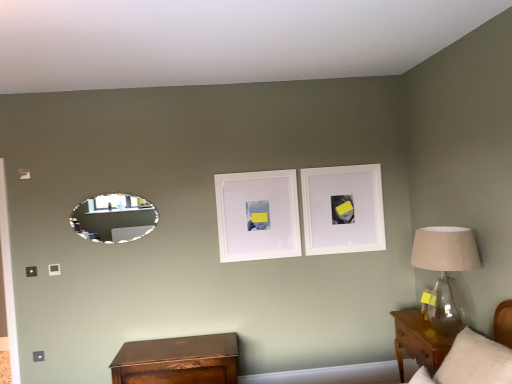
Image resolution: width=512 pixels, height=384 pixels. What do you see at coordinates (419, 341) in the screenshot?
I see `brown wood nightstand at lower right, which ranks as the second nightstand in left-to-right order` at bounding box center [419, 341].

This screenshot has height=384, width=512. What are the coordinates of `white matte picture frame at center, which is the 1th picture frame from left to right` in the screenshot? It's located at (257, 215).

Describe the element at coordinates (257, 215) in the screenshot. This screenshot has width=512, height=384. I see `white matte picture frame at center, the 2th picture frame when ordered from right to left` at that location.

You are a GUI agent. You are given a task and a screenshot of the screen. Output one action in this format:
    pyautogui.click(x=<x>, y=<y>)
    Task: Click on the clear glass lampshade at right
    
    Given the screenshot: What is the action you would take?
    pyautogui.click(x=445, y=269)

Describe the element at coordinates (445, 269) in the screenshot. I see `clear glass lampshade at right` at that location.

The image size is (512, 384). What do you see at coordinates (343, 209) in the screenshot?
I see `white matte picture frame at upper center, which is the 1th picture frame from right to left` at bounding box center [343, 209].

What is the approximate width of wooden nightstand at lower left, which is the 2th nightstand from right to left?

It is 18.38 inches.

Identify the location of brown wood nightstand at lower right, which ranks as the second nightstand in left-to-right order. This screenshot has width=512, height=384. (419, 341).

From a real-world perspective, which is physically above, brown wood nightstand at lower right, which ranks as the second nightstand in left-to-right order, or oval silver mirror at left?

From a 3D spatial view, oval silver mirror at left is above.

Could you measure the distance between brown wood nightstand at lower right, which is the 1th nightstand in right-to-left order, and oval silver mirror at left?

brown wood nightstand at lower right, which is the 1th nightstand in right-to-left order, is 2.25 meters from oval silver mirror at left.

Between point (409, 316) and point (84, 220), which one is positioned in front?

Positioned in front is point (409, 316).

Considering the positions of objects brown wood nightstand at lower right, which ranks as the second nightstand in left-to-right order, and oval silver mirror at left in the image provided, who is more to the right, brown wood nightstand at lower right, which ranks as the second nightstand in left-to-right order, or oval silver mirror at left?

From the viewer's perspective, brown wood nightstand at lower right, which ranks as the second nightstand in left-to-right order, appears more on the right side.

Is wooden nightstand at lower left, which is the 2th nightstand from right to left, outside of oval silver mirror at left?

Yes, wooden nightstand at lower left, which is the 2th nightstand from right to left, is outside of oval silver mirror at left.

Based on the photo, from the image's perspective, which object appears higher, wooden nightstand at lower left, which is the 2th nightstand from right to left, or oval silver mirror at left?

oval silver mirror at left is shown above in the image.

Considering the positions of points (228, 335) and (84, 229), is point (228, 335) closer to camera compared to point (84, 229)?

No, (228, 335) is further to viewer.

Considering the sizes of objects wooden nightstand at lower left, the first nightstand from the left, and oval silver mirror at left in the image provided, who is shorter, wooden nightstand at lower left, the first nightstand from the left, or oval silver mirror at left?

With less height is oval silver mirror at left.

From a real-world perspective, which object stands above the other?

white matte picture frame at upper center, which is the 1th picture frame from right to left, is physically above.

Is white matte picture frame at upper center, the 2th picture frame viewed from the left, a part of white matte picture frame at center, which is the 1th picture frame from left to right?

No, white matte picture frame at upper center, the 2th picture frame viewed from the left, is not a part of white matte picture frame at center, which is the 1th picture frame from left to right.

Where is `picture frame in front of the white matte picture frame at upper center, which is the 1th picture frame from right to left`? The height and width of the screenshot is (384, 512). picture frame in front of the white matte picture frame at upper center, which is the 1th picture frame from right to left is located at coordinates (257, 215).

In terms of height, does white matte picture frame at center, which is the 1th picture frame from left to right, look taller or shorter compared to white matte picture frame at upper center, the 2th picture frame viewed from the left?

Considering their sizes, white matte picture frame at center, which is the 1th picture frame from left to right, has less height than white matte picture frame at upper center, the 2th picture frame viewed from the left.

From the image's perspective, would you say white matte picture frame at upper center, which is the 1th picture frame from right to left, is positioned over brown wood nightstand at lower right, which ranks as the second nightstand in left-to-right order?

Indeed, from the image's perspective, white matte picture frame at upper center, which is the 1th picture frame from right to left, is shown above brown wood nightstand at lower right, which ranks as the second nightstand in left-to-right order.

Could you tell me if white matte picture frame at upper center, the 2th picture frame viewed from the left, is facing brown wood nightstand at lower right, which ranks as the second nightstand in left-to-right order?

No, white matte picture frame at upper center, the 2th picture frame viewed from the left, is not oriented towards brown wood nightstand at lower right, which ranks as the second nightstand in left-to-right order.

Consider the image. Could you measure the distance between white matte picture frame at upper center, the 2th picture frame viewed from the left, and brown wood nightstand at lower right, which ranks as the second nightstand in left-to-right order?

The distance of white matte picture frame at upper center, the 2th picture frame viewed from the left, from brown wood nightstand at lower right, which ranks as the second nightstand in left-to-right order, is 36.34 inches.

Is white matte picture frame at upper center, the 2th picture frame viewed from the left, inside the boundaries of brown wood nightstand at lower right, which ranks as the second nightstand in left-to-right order, or outside?

white matte picture frame at upper center, the 2th picture frame viewed from the left, is spatially situated outside brown wood nightstand at lower right, which ranks as the second nightstand in left-to-right order.

Is white matte picture frame at upper center, the 2th picture frame viewed from the left, aimed at oval silver mirror at left?

No, white matte picture frame at upper center, the 2th picture frame viewed from the left, is not turned towards oval silver mirror at left.

How much distance is there between white matte picture frame at upper center, which is the 1th picture frame from right to left, and oval silver mirror at left?

The distance of white matte picture frame at upper center, which is the 1th picture frame from right to left, from oval silver mirror at left is 5.09 feet.

Between point (375, 234) and point (82, 205), which one is positioned behind?

The point (375, 234) is behind.

From the image's perspective, would you say white matte picture frame at upper center, which is the 1th picture frame from right to left, is shown under oval silver mirror at left?

Actually, white matte picture frame at upper center, which is the 1th picture frame from right to left, appears above oval silver mirror at left in the image.

Is white matte picture frame at upper center, the 2th picture frame viewed from the left, inside or outside of wooden nightstand at lower left, the first nightstand from the left?

The correct answer is: outside.

Considering their positions, is white matte picture frame at upper center, which is the 1th picture frame from right to left, located in front of or behind wooden nightstand at lower left, the first nightstand from the left?

Clearly, white matte picture frame at upper center, which is the 1th picture frame from right to left, is behind wooden nightstand at lower left, the first nightstand from the left.

Considering the sizes of objects white matte picture frame at upper center, which is the 1th picture frame from right to left, and wooden nightstand at lower left, which is the 2th nightstand from right to left, in the image provided, who is smaller, white matte picture frame at upper center, which is the 1th picture frame from right to left, or wooden nightstand at lower left, which is the 2th nightstand from right to left,?

Smaller between the two is white matte picture frame at upper center, which is the 1th picture frame from right to left.

Could you tell me if white matte picture frame at upper center, which is the 1th picture frame from right to left, is turned towards wooden nightstand at lower left, the first nightstand from the left?

No, white matte picture frame at upper center, which is the 1th picture frame from right to left, is not oriented towards wooden nightstand at lower left, the first nightstand from the left.

From the image's perspective, between oval silver mirror at left and clear glass lampshade at right, which one is located above?

oval silver mirror at left, from the image's perspective.

Is oval silver mirror at left spatially inside clear glass lampshade at right, or outside of it?

oval silver mirror at left is located beyond the bounds of clear glass lampshade at right.

Are oval silver mirror at left and clear glass lampshade at right beside each other?

No, oval silver mirror at left is not touching clear glass lampshade at right.

Between oval silver mirror at left and clear glass lampshade at right, which one appears on the right side from the viewer's perspective?

clear glass lampshade at right.

Locate an element on the screen. This screenshot has height=384, width=512. mirror that appears on the left of brown wood nightstand at lower right, which is the 1th nightstand in right-to-left order is located at coordinates (114, 218).

Which nightstand is the 1st one when counting from the right side of the oval silver mirror at left? Please provide its 2D coordinates.

[(178, 361)]

Which object lies further to the anchor point brown wood nightstand at lower right, which ranks as the second nightstand in left-to-right order, white matte picture frame at upper center, the 2th picture frame viewed from the left, or clear glass lampshade at right?

white matte picture frame at upper center, the 2th picture frame viewed from the left, is further to brown wood nightstand at lower right, which ranks as the second nightstand in left-to-right order.

Based on their spatial positions, is white matte picture frame at upper center, which is the 1th picture frame from right to left, or clear glass lampshade at right further from oval silver mirror at left?

Based on the image, clear glass lampshade at right appears to be further to oval silver mirror at left.

When comparing their distances from white matte picture frame at upper center, the 2th picture frame viewed from the left, does oval silver mirror at left or brown wood nightstand at lower right, which ranks as the second nightstand in left-to-right order, seem closer?

The object closer to white matte picture frame at upper center, the 2th picture frame viewed from the left, is brown wood nightstand at lower right, which ranks as the second nightstand in left-to-right order.

Which object lies nearer to the anchor point brown wood nightstand at lower right, which is the 1th nightstand in right-to-left order, clear glass lampshade at right or white matte picture frame at upper center, which is the 1th picture frame from right to left?

clear glass lampshade at right is positioned closer to the anchor brown wood nightstand at lower right, which is the 1th nightstand in right-to-left order.

Based on their spatial positions, is white matte picture frame at upper center, which is the 1th picture frame from right to left, or oval silver mirror at left further from brown wood nightstand at lower right, which is the 1th nightstand in right-to-left order?

Based on the image, oval silver mirror at left appears to be further to brown wood nightstand at lower right, which is the 1th nightstand in right-to-left order.

Which object lies nearer to the anchor point white matte picture frame at upper center, the 2th picture frame viewed from the left, wooden nightstand at lower left, which is the 2th nightstand from right to left, or clear glass lampshade at right?

clear glass lampshade at right is closer to white matte picture frame at upper center, the 2th picture frame viewed from the left.

From the image, which object appears to be nearer to wooden nightstand at lower left, which is the 2th nightstand from right to left, white matte picture frame at upper center, the 2th picture frame viewed from the left, or oval silver mirror at left?

oval silver mirror at left is positioned closer to the anchor wooden nightstand at lower left, which is the 2th nightstand from right to left.

Looking at this image, when comparing their distances from white matte picture frame at upper center, the 2th picture frame viewed from the left, does white matte picture frame at center, the 2th picture frame when ordered from right to left, or oval silver mirror at left seem further?

oval silver mirror at left.

Locate an element on the screen. The image size is (512, 384). picture frame positioned between clear glass lampshade at right and white matte picture frame at upper center, which is the 1th picture frame from right to left, from near to far is located at coordinates click(257, 215).

Identify the location of table lamp between wooden nightstand at lower left, the first nightstand from the left, and brown wood nightstand at lower right, which is the 1th nightstand in right-to-left order. This screenshot has height=384, width=512. (445, 269).

This screenshot has width=512, height=384. In order to click on table lamp between oval silver mirror at left and brown wood nightstand at lower right, which is the 1th nightstand in right-to-left order in this screenshot , I will do `click(445, 269)`.

I want to click on table lamp between white matte picture frame at center, which is the 1th picture frame from left to right, and brown wood nightstand at lower right, which ranks as the second nightstand in left-to-right order, so [445, 269].